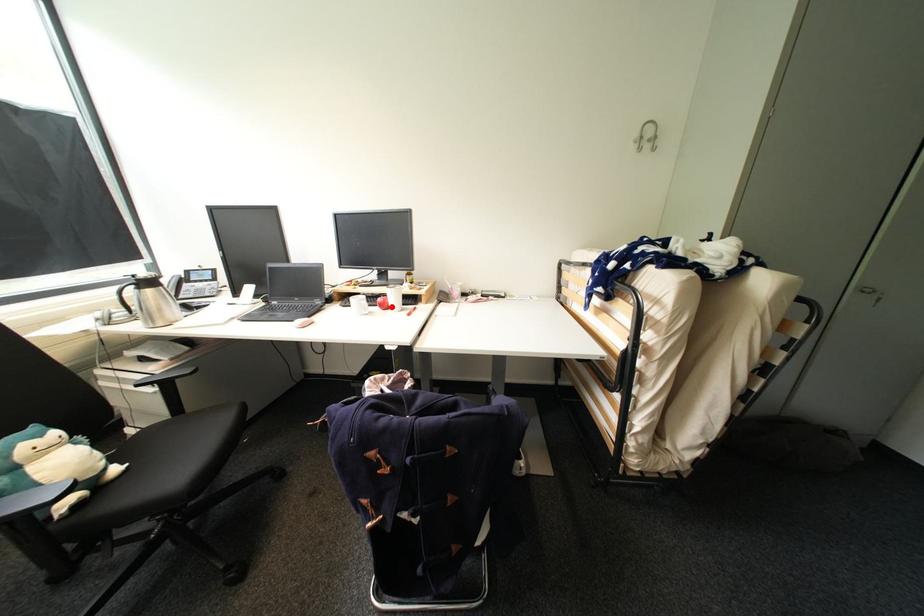
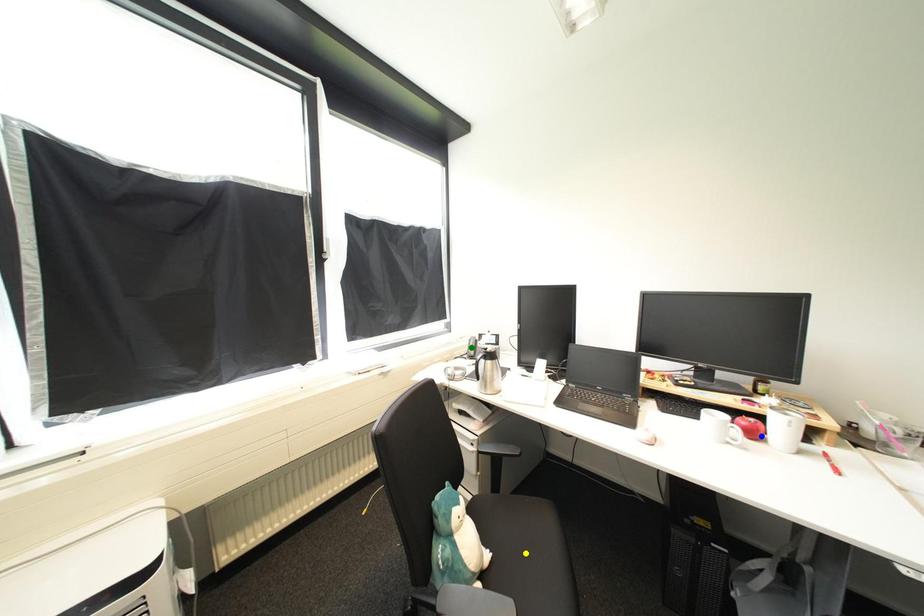
Question: I am providing you with two images of the same scene from different viewpoints. A red point is marked on the first image. You are given multiple points on the second image. Which point in image 2 is actually the same real-world point as the red point in image 1?

Choices:
 (A) green point
 (B) yellow point
 (C) blue point

Answer: (C)